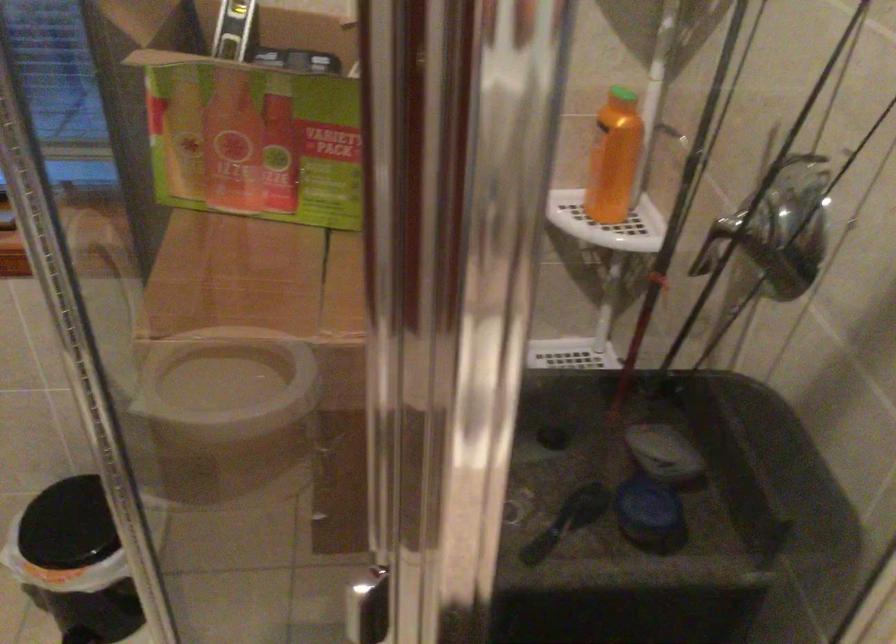
Where is `metal shower head`? metal shower head is located at coordinates (712, 245).